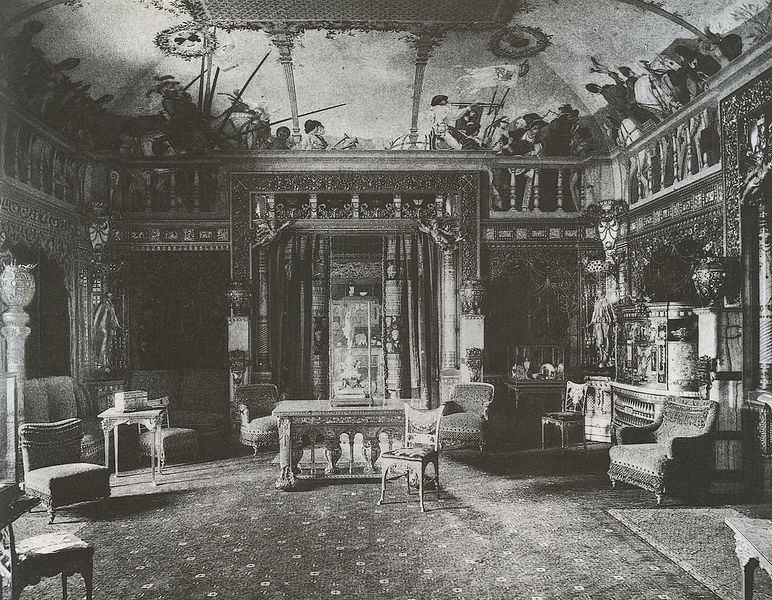
The width and height of the screenshot is (772, 600). Find the location of `drapes`. drapes is located at coordinates (414, 282).